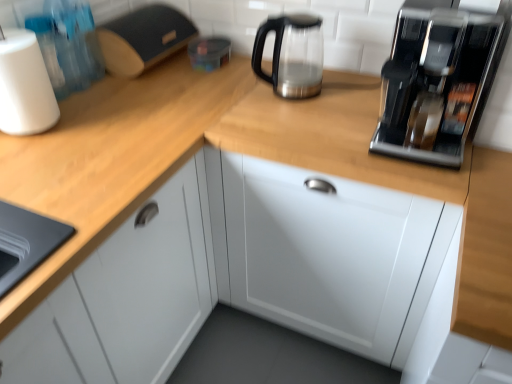
Question: Could sleek metallic coffee machine at upper right be considered to be inside satin metallic kettle at upper center?

Choices:
 (A) no
 (B) yes

Answer: (A)

Question: Considering the relative positions of satin metallic kettle at upper center and sleek metallic coffee machine at upper right in the image provided, is satin metallic kettle at upper center in front of sleek metallic coffee machine at upper right?

Choices:
 (A) yes
 (B) no

Answer: (B)

Question: Does satin metallic kettle at upper center have a greater height compared to sleek metallic coffee machine at upper right?

Choices:
 (A) no
 (B) yes

Answer: (A)

Question: Is satin metallic kettle at upper center oriented towards sleek metallic coffee machine at upper right?

Choices:
 (A) yes
 (B) no

Answer: (B)

Question: From the image's perspective, is satin metallic kettle at upper center under sleek metallic coffee machine at upper right?

Choices:
 (A) yes
 (B) no

Answer: (B)

Question: Is satin metallic kettle at upper center further to the viewer compared to sleek metallic coffee machine at upper right?

Choices:
 (A) no
 (B) yes

Answer: (B)

Question: From the image's perspective, is wooden at left above white glossy cabinet at center?

Choices:
 (A) no
 (B) yes

Answer: (A)

Question: Does wooden at left lie in front of white glossy cabinet at center?

Choices:
 (A) yes
 (B) no

Answer: (A)

Question: Considering the relative sizes of wooden at left and white glossy cabinet at center in the image provided, is wooden at left taller than white glossy cabinet at center?

Choices:
 (A) no
 (B) yes

Answer: (A)

Question: Is wooden at left thinner than white glossy cabinet at center?

Choices:
 (A) yes
 (B) no

Answer: (B)

Question: Can you confirm if wooden at left is wider than white glossy cabinet at center?

Choices:
 (A) yes
 (B) no

Answer: (A)

Question: Is wooden at left outside white glossy cabinet at center?

Choices:
 (A) no
 (B) yes

Answer: (B)

Question: Can you confirm if white matte paper towel at left is positioned to the right of wooden at left?

Choices:
 (A) no
 (B) yes

Answer: (A)